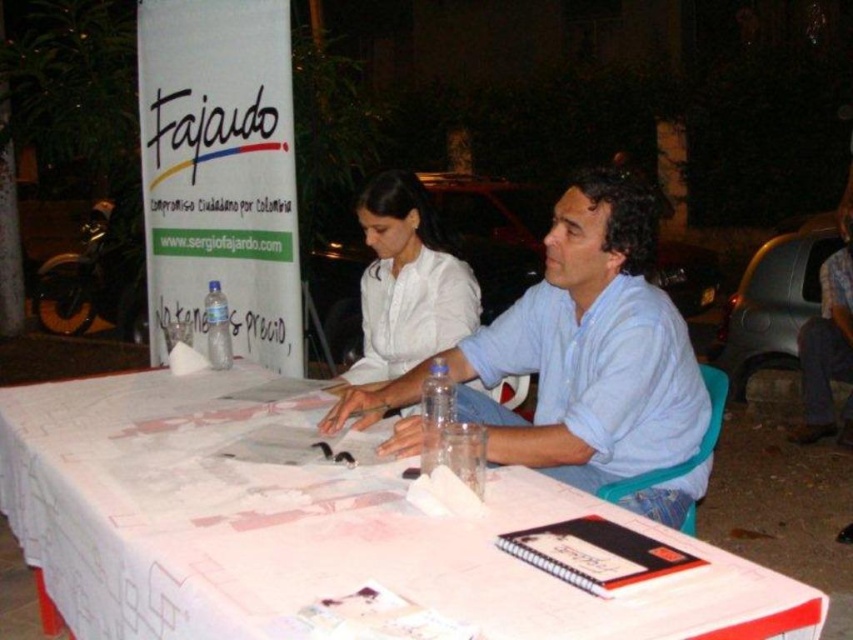
Question: Does white paper at center have a smaller size compared to white matte shirt at center?

Choices:
 (A) yes
 (B) no

Answer: (B)

Question: Among these points, which one is farthest from the camera?

Choices:
 (A) (682, 410)
 (B) (733, 618)

Answer: (A)

Question: Which object appears farthest from the camera in this image?

Choices:
 (A) white matte shirt at center
 (B) white paper at center
 (C) light blue shirt at center

Answer: (A)

Question: Does light blue shirt at center appear on the right side of white matte shirt at center?

Choices:
 (A) yes
 (B) no

Answer: (A)

Question: Which object is closer to the camera taking this photo?

Choices:
 (A) light blue shirt at center
 (B) white matte shirt at center
 (C) white paper at center

Answer: (C)

Question: Is light blue shirt at center in front of white matte shirt at center?

Choices:
 (A) no
 (B) yes

Answer: (B)